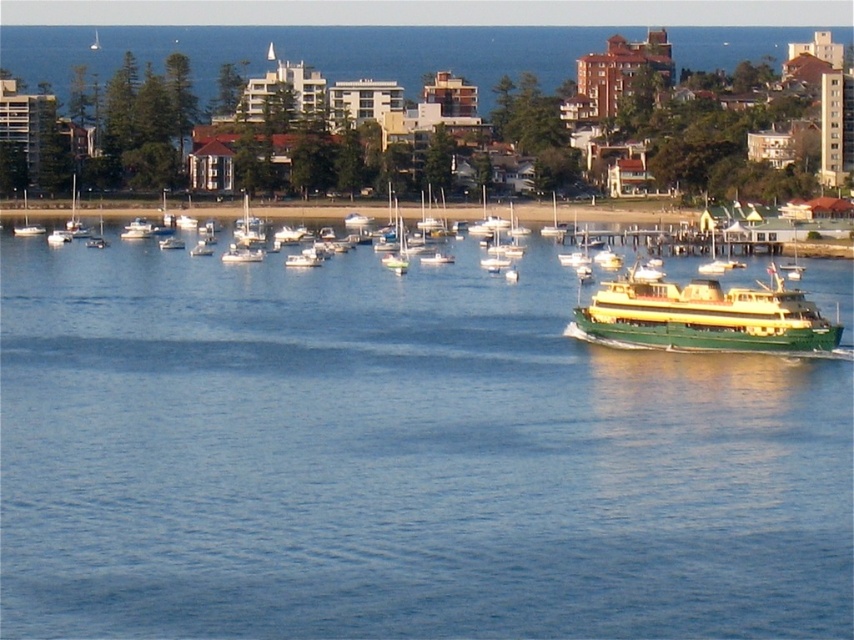
Question: Among these objects, which one is nearest to the camera?

Choices:
 (A) green polished ferry at right
 (B) white matte sailboat at left
 (C) blue water at center

Answer: (C)

Question: Can you confirm if white glossy sailboat at center-left is positioned above white matte sailboat at left?

Choices:
 (A) no
 (B) yes

Answer: (A)

Question: Observing the image, what is the correct spatial positioning of green polished ferry at right in reference to white glossy sailboat at center-left?

Choices:
 (A) left
 (B) right

Answer: (B)

Question: Estimate the real-world distances between objects in this image. Which object is farther from the white matte sailboat at left?

Choices:
 (A) white glossy sailboat at center-left
 (B) green polished ferry at right
 (C) blue water at center

Answer: (B)

Question: Does green polished ferry at right lie behind white matte sailboat at left?

Choices:
 (A) yes
 (B) no

Answer: (B)

Question: Among these objects, which one is nearest to the camera?

Choices:
 (A) white glossy sailboat at center-left
 (B) green polished ferry at right
 (C) blue water at center
 (D) white matte sailboat at left

Answer: (C)